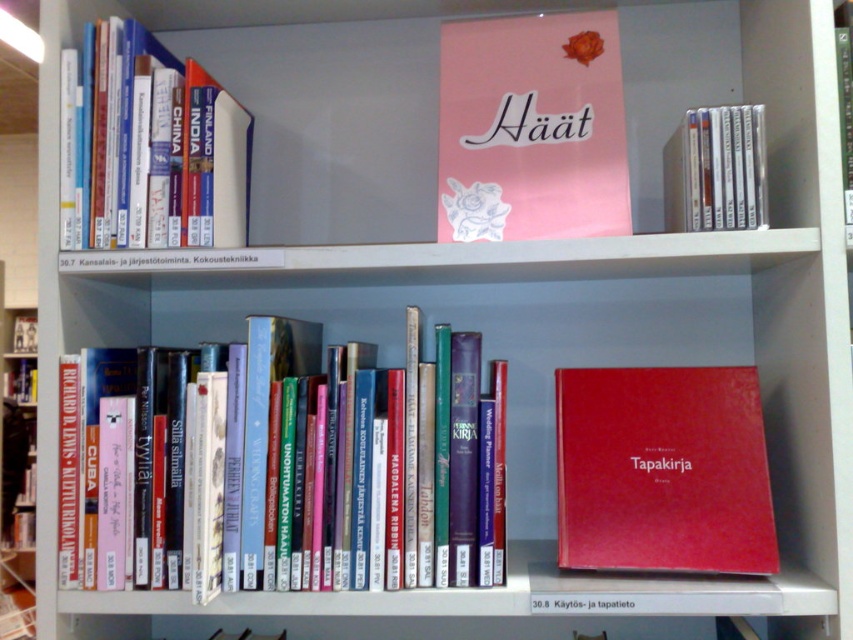
Question: Considering the relative positions of hardcover books at center and matte white cd case at upper right in the image provided, where is hardcover books at center located with respect to matte white cd case at upper right?

Choices:
 (A) above
 (B) below

Answer: (B)

Question: Which object is closer to the camera taking this photo?

Choices:
 (A) hardcover books at left
 (B) red matte book at right
 (C) hardcover books at center

Answer: (C)

Question: Does pink matte book at upper center appear on the left side of hardcover books at left?

Choices:
 (A) yes
 (B) no

Answer: (B)

Question: Which point appears farthest from the camera in this image?

Choices:
 (A) (497, 97)
 (B) (201, 472)

Answer: (A)

Question: Can you confirm if pink matte book at upper center is positioned above hardcover books at left?

Choices:
 (A) no
 (B) yes

Answer: (B)

Question: Among these objects, which one is nearest to the camera?

Choices:
 (A) hardcover books at left
 (B) pink matte book at upper center
 (C) hardcover books at center

Answer: (C)